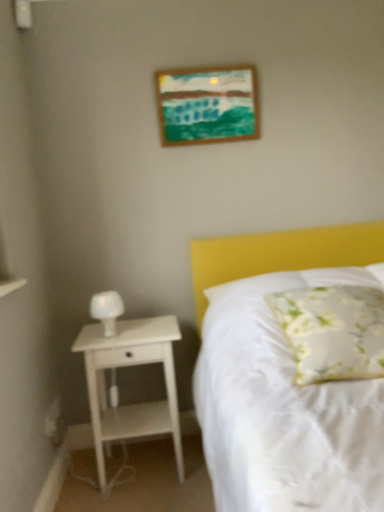
Question: From a real-world perspective, is floral fabric pillow at center on top of white wood nightstand at left?

Choices:
 (A) no
 (B) yes

Answer: (B)

Question: Can you confirm if floral fabric pillow at center is bigger than white wood nightstand at left?

Choices:
 (A) yes
 (B) no

Answer: (B)

Question: From the image's perspective, is floral fabric pillow at center located beneath white wood nightstand at left?

Choices:
 (A) yes
 (B) no

Answer: (B)

Question: Is floral fabric pillow at center far away from white wood nightstand at left?

Choices:
 (A) yes
 (B) no

Answer: (B)

Question: Is floral fabric pillow at center outside of white wood nightstand at left?

Choices:
 (A) no
 (B) yes

Answer: (B)

Question: Relative to white wood nightstand at left, is white matte bedside lamp at left in front or behind?

Choices:
 (A) front
 (B) behind

Answer: (B)

Question: From a real-world perspective, is white matte bedside lamp at left above or below white wood nightstand at left?

Choices:
 (A) above
 (B) below

Answer: (A)

Question: Is white matte bedside lamp at left situated inside white wood nightstand at left or outside?

Choices:
 (A) inside
 (B) outside

Answer: (B)

Question: Considering the positions of white matte bedside lamp at left and white wood nightstand at left in the image, is white matte bedside lamp at left bigger or smaller than white wood nightstand at left?

Choices:
 (A) small
 (B) big

Answer: (A)

Question: From a real-world perspective, is floral fabric pillow at center positioned above or below white wood nightstand at left?

Choices:
 (A) above
 (B) below

Answer: (A)

Question: Considering the positions of floral fabric pillow at center and white wood nightstand at left in the image, is floral fabric pillow at center taller or shorter than white wood nightstand at left?

Choices:
 (A) tall
 (B) short

Answer: (B)

Question: Visually, is floral fabric pillow at center positioned to the left or to the right of white wood nightstand at left?

Choices:
 (A) left
 (B) right

Answer: (B)

Question: Is floral fabric pillow at center inside or outside of white wood nightstand at left?

Choices:
 (A) inside
 (B) outside

Answer: (B)

Question: Is wooden picture frame at upper center in front of or behind floral fabric pillow at center in the image?

Choices:
 (A) front
 (B) behind

Answer: (B)

Question: Based on their sizes in the image, would you say wooden picture frame at upper center is bigger or smaller than floral fabric pillow at center?

Choices:
 (A) small
 (B) big

Answer: (A)